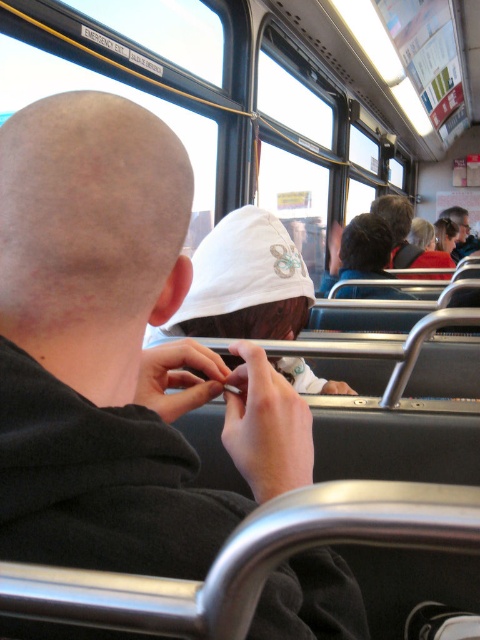
Is bald scalp at center behind white fabric hat at center?

No, bald scalp at center is in front of white fabric hat at center.

Is point (23, 148) positioned in front of point (252, 234)?

Yes, it is in front of point (252, 234).

Identify the location of bald scalp at center. The width and height of the screenshot is (480, 640). (91, 236).

Identify the location of bald scalp at center. The height and width of the screenshot is (640, 480). (91, 236).

Based on the photo, does black matte shirt at center have a smaller size compared to dark brown hair at upper center?

Yes.

Does point (108, 458) come behind point (405, 225)?

No, it is not.

Find the location of a particular element. Image resolution: width=480 pixels, height=640 pixels. black matte shirt at center is located at coordinates (116, 353).

Between bald scalp at center and silvery metallic hair at center, which one is positioned lower?

Positioned lower is bald scalp at center.

Does bald scalp at center have a lesser width compared to silvery metallic hair at center?

Indeed, bald scalp at center has a lesser width compared to silvery metallic hair at center.

You are a GUI agent. You are given a task and a screenshot of the screen. Output one action in this format:
    pyautogui.click(x=<x>, y=<y>)
    Task: Click on the bald scalp at center
    Image resolution: width=480 pixels, height=640 pixels.
    Given the screenshot: What is the action you would take?
    point(91,236)

Locate an element on the screen. The width and height of the screenshot is (480, 640). bald scalp at center is located at coordinates (91, 236).